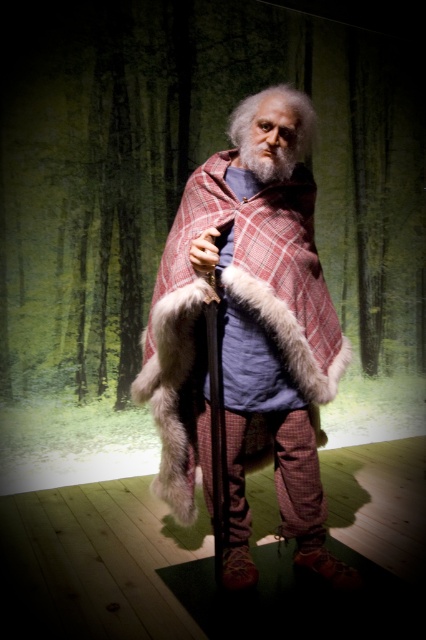
Does plaid wool cape at center have a lesser width compared to graywoollybeard at center?

Incorrect, plaid wool cape at center's width is not less than graywoollybeard at center's.

Who is more distant from viewer, (241, 548) or (255, 163)?

The point (241, 548) is behind.

The height and width of the screenshot is (640, 426). What do you see at coordinates (247, 339) in the screenshot?
I see `plaid wool cape at center` at bounding box center [247, 339].

In order to click on plaid wool cape at center in this screenshot , I will do `click(247, 339)`.